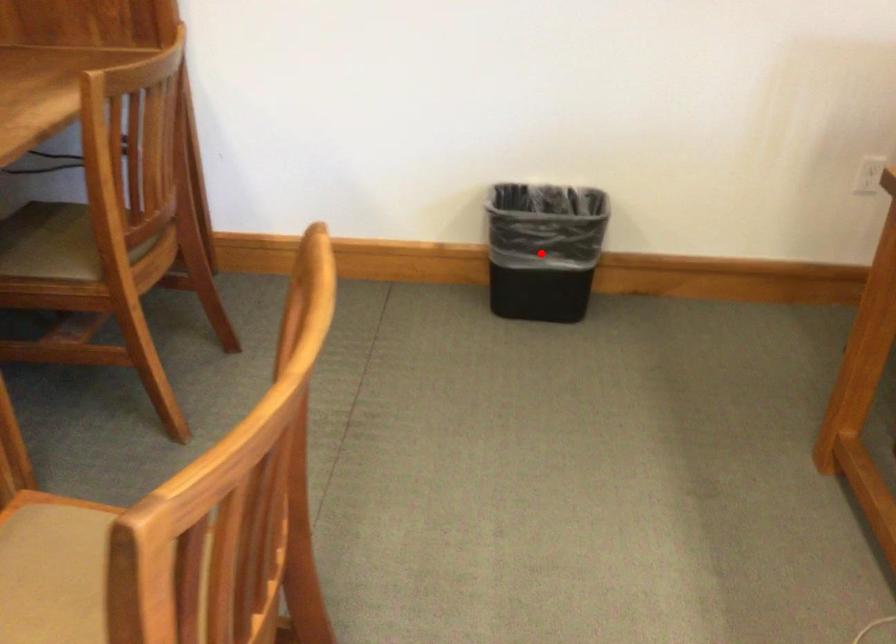
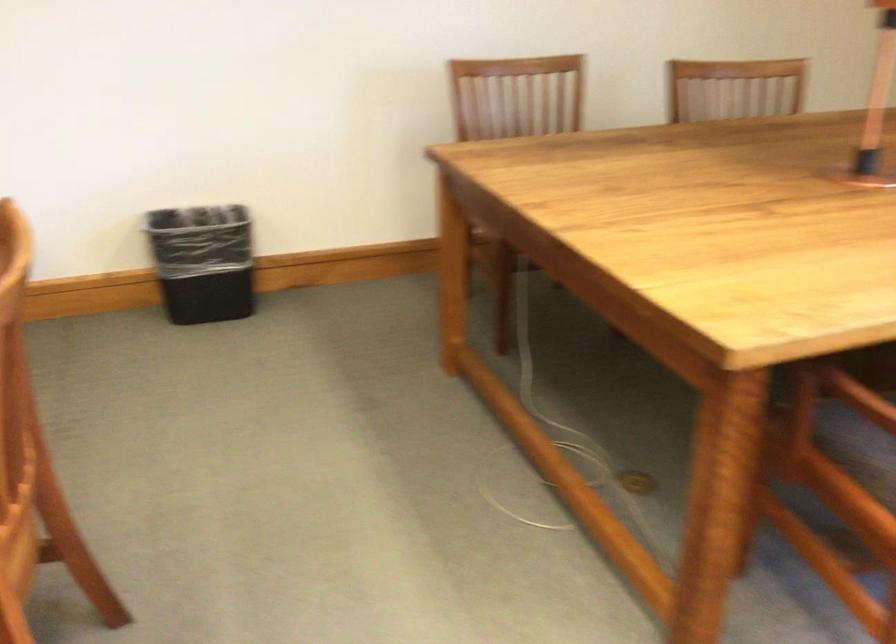
Question: I am providing you with two images of the same scene from different viewpoints. A red point is marked on the first image. Can you still see the location of the red point in image 2?

Choices:
 (A) Yes
 (B) No

Answer: (A)